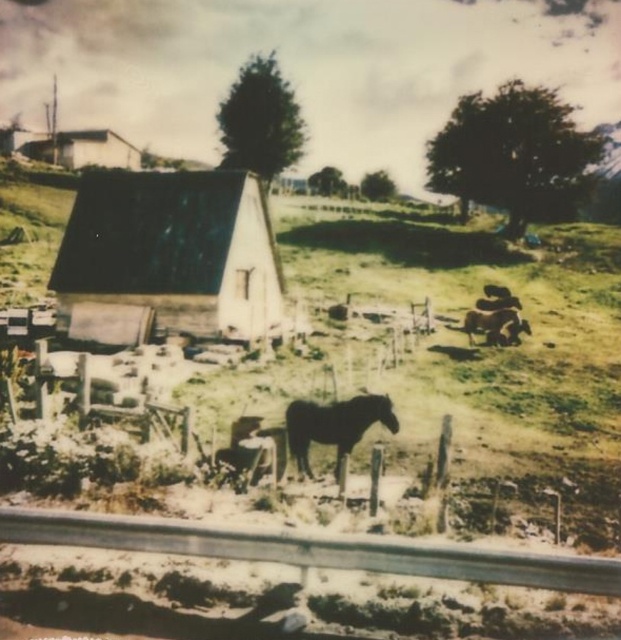
You are a photographer planning to take a picture of the wooden hut at center and the dark brown horse at center. Based on their sizes in the scene, which one will appear larger in the photo?

The wooden hut at center will appear larger in the photo because it is much taller than the dark brown horse at center.

You are a traveler on a road and see the wooden hut at center and the dark brown horse at center. Which one is closer to the road?

The wooden hut at center is closer to the road because it is positioned to the left of the dark brown horse at center, which is further away from the road.

You are a photographer trying to capture a clear shot of the dark brown horse at center without the wooden hut at center blocking it. Is this possible given their positions?

The wooden hut at center is positioned over dark brown horse at center, so it will block the view of the horse. You cannot capture a clear shot of the dark brown horse at center without the wooden hut at center blocking it.